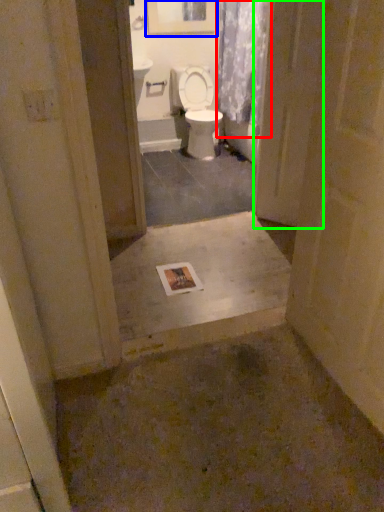
Question: Considering the real-world distances, which object is farthest from shower curtain (highlighted by a red box)? picture frame (highlighted by a blue box) or screen door (highlighted by a green box)?

Choices:
 (A) picture frame
 (B) screen door

Answer: (B)